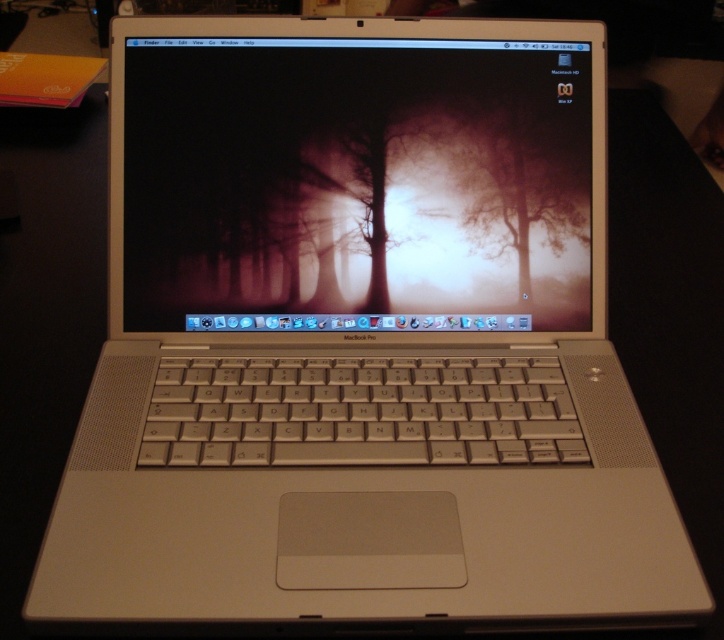
From the picture: Does satin silver laptop at center appear on the left side of translucent foggy tree at center?

Yes, satin silver laptop at center is to the left of translucent foggy tree at center.

In the scene shown: Which of these two, satin silver laptop at center or translucent foggy tree at center, stands shorter?

translucent foggy tree at center

I want to click on satin silver laptop at center, so click(361, 179).